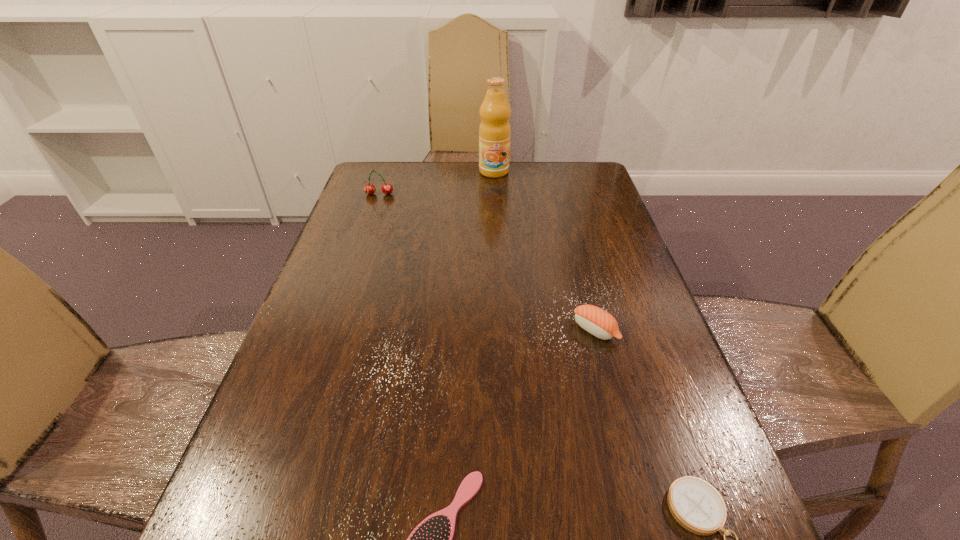
The image size is (960, 540). I want to click on the tallest object, so click(x=494, y=131).

You are a GUI agent. You are given a task and a screenshot of the screen. Output one action in this format:
    pyautogui.click(x=<x>, y=<y>)
    Task: Click on the fruit juice
    The image size is (960, 540).
    Given the screenshot: What is the action you would take?
    pyautogui.click(x=494, y=131)

In order to click on the fourth nearest object in this screenshot , I will do `click(387, 188)`.

Find the location of a particular element. The image size is (960, 540). cherry is located at coordinates (387, 188).

Where is `the third nearest object`? The image size is (960, 540). the third nearest object is located at coordinates (598, 322).

The width and height of the screenshot is (960, 540). In order to click on sushi in this screenshot , I will do `click(598, 322)`.

Identify the location of vacant space located on the front label of the farthest object. The width and height of the screenshot is (960, 540). (497, 232).

Find the location of `vacant region located with stems pointing upwards on the second farthest object`. vacant region located with stems pointing upwards on the second farthest object is located at coordinates (364, 240).

This screenshot has width=960, height=540. Identify the location of vacant region located 0.180m on the left of the third nearest object. (491, 330).

At what (x,y) coordinates should I click in order to perform the action: click on fruit juice that is at the far edge. Please return your answer as a coordinate pair (x, y). Looking at the image, I should click on (494, 131).